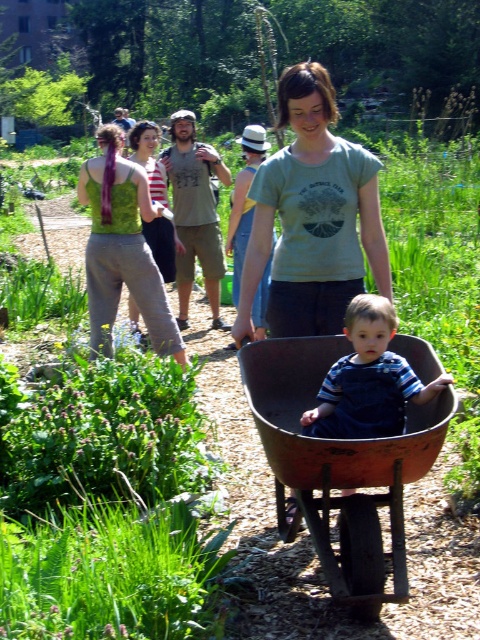
Question: Does green fabric tank top at upper left come in front of blue denim overalls at center?

Choices:
 (A) yes
 (B) no

Answer: (B)

Question: Which point is closer to the camera taking this photo?

Choices:
 (A) (297, 464)
 (B) (129, 244)
 (C) (382, 355)
 (D) (321, 320)

Answer: (A)

Question: Among these points, which one is farthest from the camera?

Choices:
 (A) (362, 296)
 (B) (346, 340)
 (C) (152, 212)
 (D) (294, 92)

Answer: (C)

Question: Which object is closer to the camera taking this photo?

Choices:
 (A) green t-shirt at center
 (B) rusty metal wheelbarrow at center
 (C) green matte tank top at center

Answer: (B)

Question: Considering the relative positions of rusty metal wheelbarrow at center and green fabric tank top at upper left in the image provided, where is rusty metal wheelbarrow at center located with respect to green fabric tank top at upper left?

Choices:
 (A) right
 (B) left

Answer: (A)

Question: Can you confirm if green fabric tank top at upper left is positioned to the left of blue denim overalls at center?

Choices:
 (A) no
 (B) yes

Answer: (B)